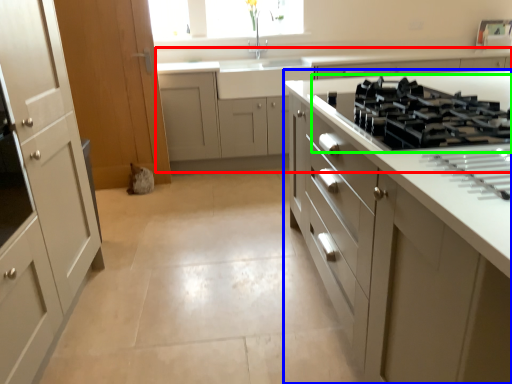
Question: Which object is positioned closest to cabinetry (highlighted by a red box)? Select from cabinetry (highlighted by a blue box) and gas stove (highlighted by a green box).

Choices:
 (A) cabinetry
 (B) gas stove

Answer: (A)